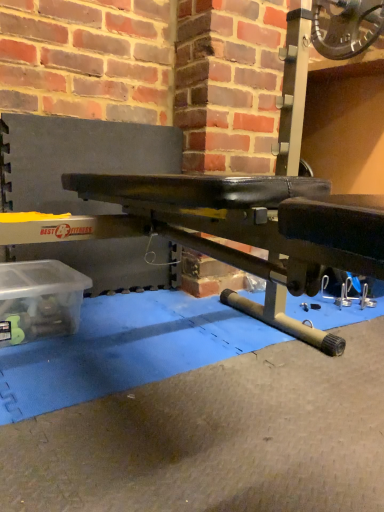
Identify the location of vacant space situated above transparent plastic container at lower left (from a real-world perspective). (37, 277).